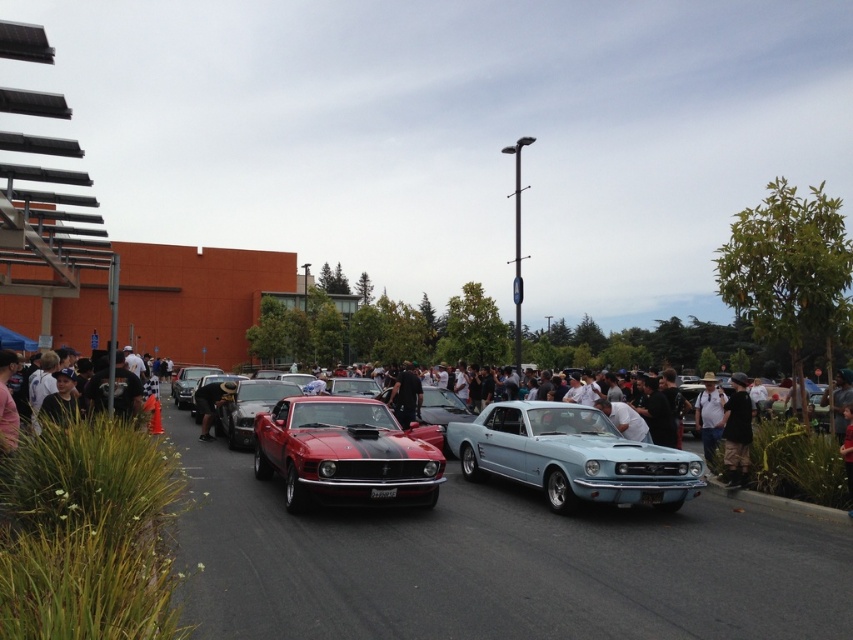
Can you confirm if shiny red car at center is shorter than black leather jacket at center?

In fact, shiny red car at center may be taller than black leather jacket at center.

Can you confirm if shiny red car at center is smaller than black leather jacket at center?

No.

The width and height of the screenshot is (853, 640). What do you see at coordinates (248, 408) in the screenshot?
I see `shiny red car at center` at bounding box center [248, 408].

Where is `shiny red car at center`? This screenshot has height=640, width=853. shiny red car at center is located at coordinates (248, 408).

From the picture: Can you confirm if shiny red muscle car at center is positioned to the right of black leather jacket at center?

No, shiny red muscle car at center is not to the right of black leather jacket at center.

Measure the distance between shiny red muscle car at center and camera.

The distance of shiny red muscle car at center from camera is 7.83 meters.

The height and width of the screenshot is (640, 853). Find the location of `shiny red muscle car at center`. shiny red muscle car at center is located at coordinates (343, 452).

Does point (747, 458) come in front of point (413, 397)?

Yes, point (747, 458) is closer to viewer.

Can you confirm if dark brown leather jacket at center is bigger than black leather jacket at center?

Yes, dark brown leather jacket at center is bigger than black leather jacket at center.

Between point (741, 392) and point (410, 417), which one is positioned behind?

The point (410, 417) is more distant.

The image size is (853, 640). I want to click on dark brown leather jacket at center, so click(735, 432).